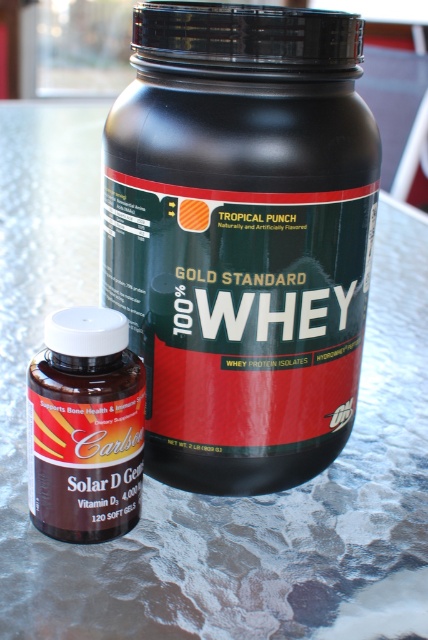
Question: Which object appears closest to the camera in this image?

Choices:
 (A) black matte protein powder container at center
 (B) brown/glassy bottle at lower left

Answer: (A)

Question: Which of the following is the farthest from the observer?

Choices:
 (A) black matte protein powder container at center
 (B) brown/glassy bottle at lower left

Answer: (B)

Question: Is black matte protein powder container at center smaller than brown/glassy bottle at lower left?

Choices:
 (A) yes
 (B) no

Answer: (B)

Question: Can you confirm if black matte protein powder container at center is positioned to the left of brown/glassy bottle at lower left?

Choices:
 (A) no
 (B) yes

Answer: (A)

Question: Does black matte protein powder container at center appear on the right side of brown/glassy bottle at lower left?

Choices:
 (A) yes
 (B) no

Answer: (A)